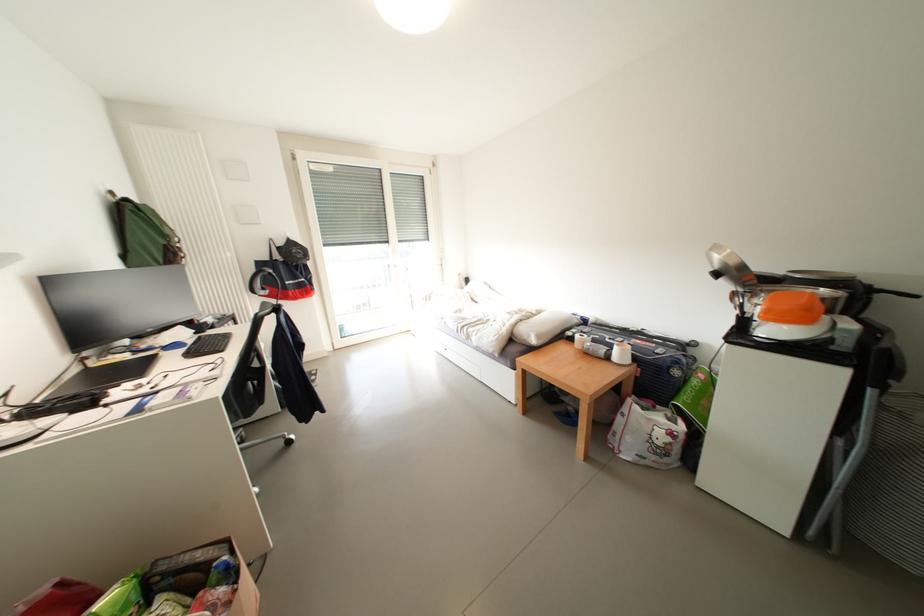
The image size is (924, 616). Find the location of `suitcase handle`. suitcase handle is located at coordinates (674, 367).